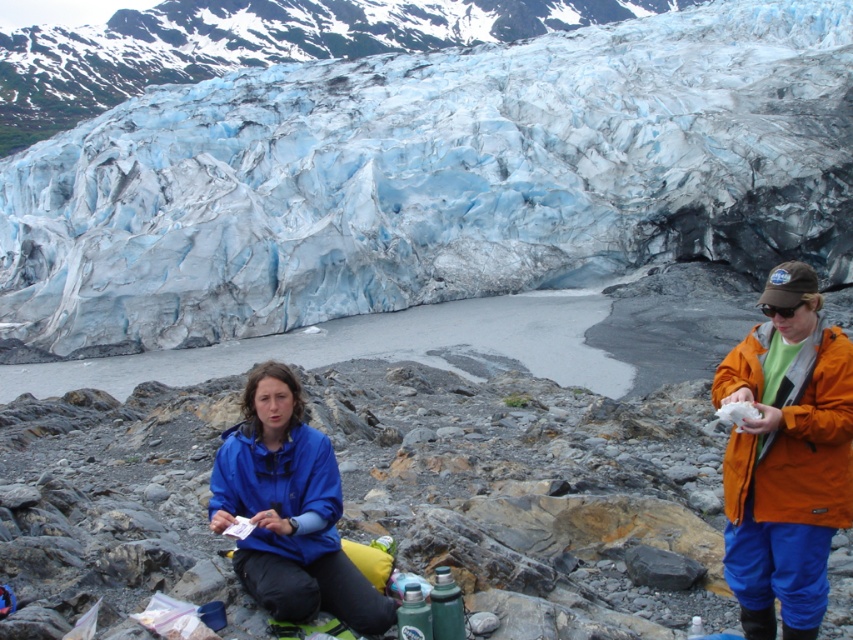
Question: Is blue ice glacier at center bigger than blue matte jacket at lower center?

Choices:
 (A) yes
 (B) no

Answer: (A)

Question: Which of the following is the closest to the observer?

Choices:
 (A) (248, 420)
 (B) (9, 273)

Answer: (A)

Question: Can you confirm if blue ice glacier at center is positioned below blue matte jacket at lower center?

Choices:
 (A) no
 (B) yes

Answer: (A)

Question: Can you confirm if blue ice glacier at center is bigger than blue matte jacket at lower center?

Choices:
 (A) no
 (B) yes

Answer: (B)

Question: Among these points, which one is nearest to the camera?

Choices:
 (A) (469, 132)
 (B) (335, 502)

Answer: (B)